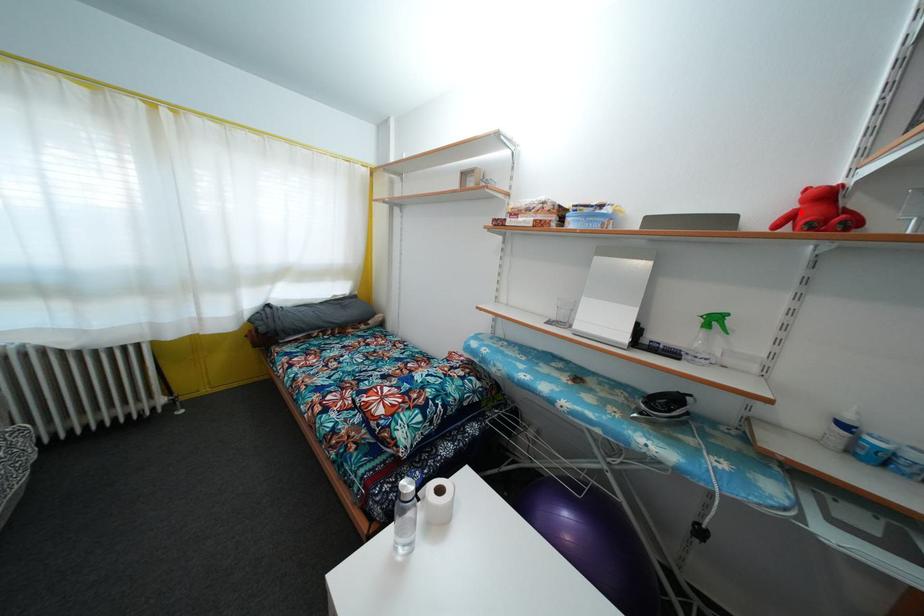
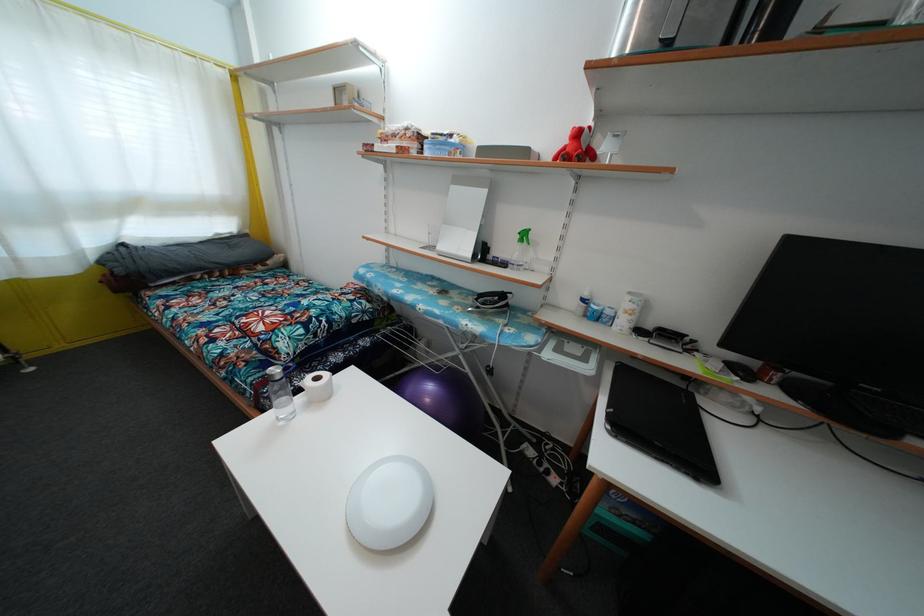
The point at the highlighted location is marked in the first image. Where is the corresponding point in the second image?

(570, 148)